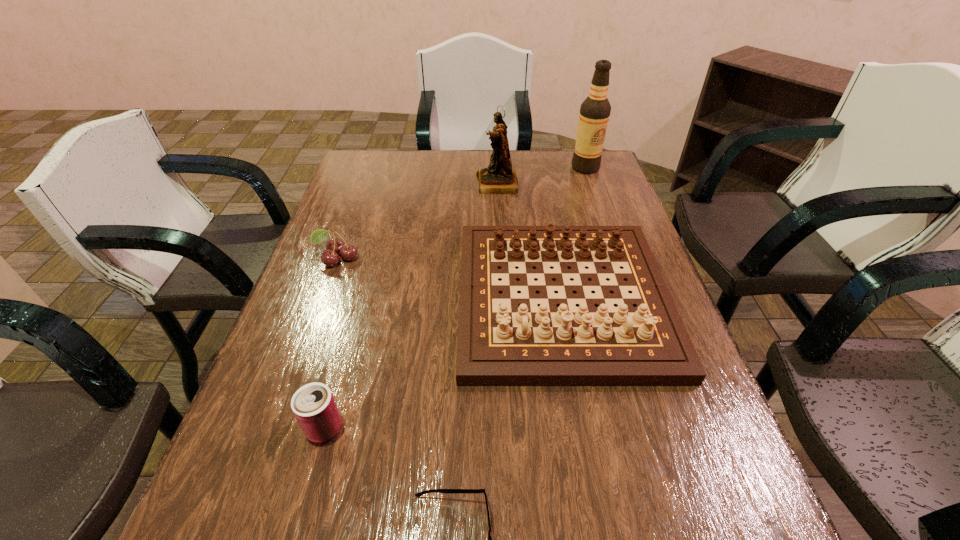
Where is `vacant space that satisfies the following two spatial constraints: 1. on the leaves of the cherry; 2. on the right side of the can`? This screenshot has height=540, width=960. vacant space that satisfies the following two spatial constraints: 1. on the leaves of the cherry; 2. on the right side of the can is located at coordinates (276, 428).

Where is `free space that satisfies the following two spatial constraints: 1. on the front-facing side of the fifth shortest object; 2. on the leaves of the cherry`? Image resolution: width=960 pixels, height=540 pixels. free space that satisfies the following two spatial constraints: 1. on the front-facing side of the fifth shortest object; 2. on the leaves of the cherry is located at coordinates (501, 259).